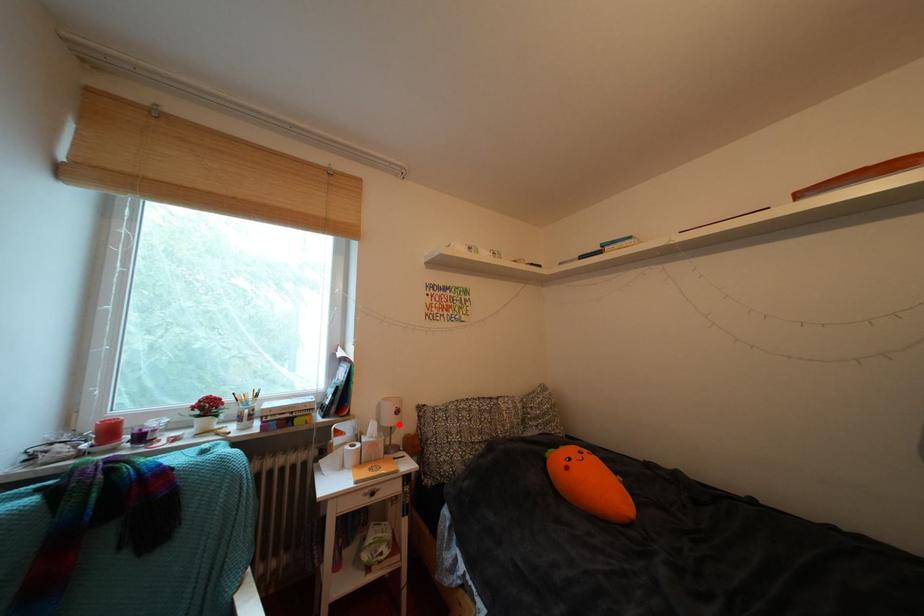
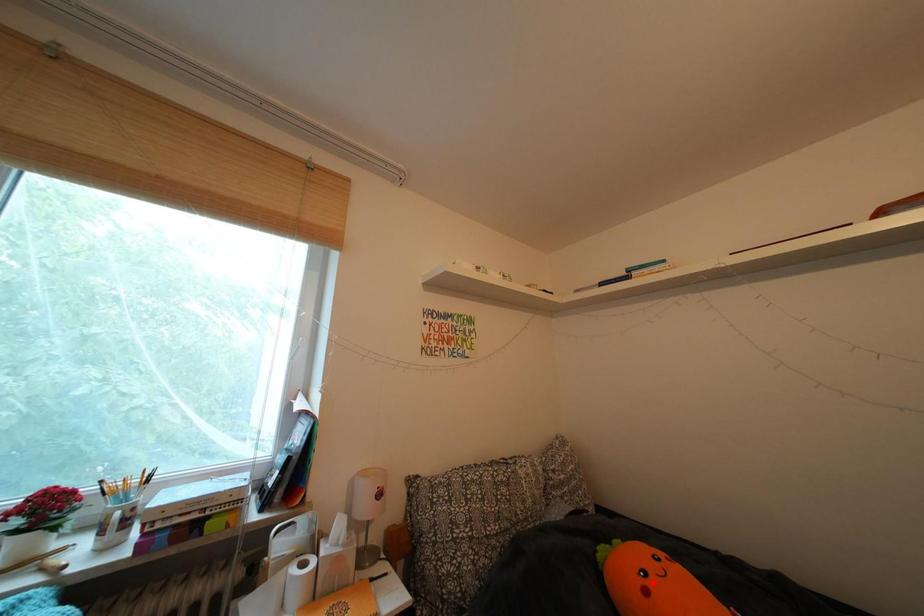
I am providing you with two images of the same scene from different viewpoints. A red point is marked on the first image and another point is marked on the second image. Do the highlighted points in image1 and image2 indicate the same real-world spot?

No